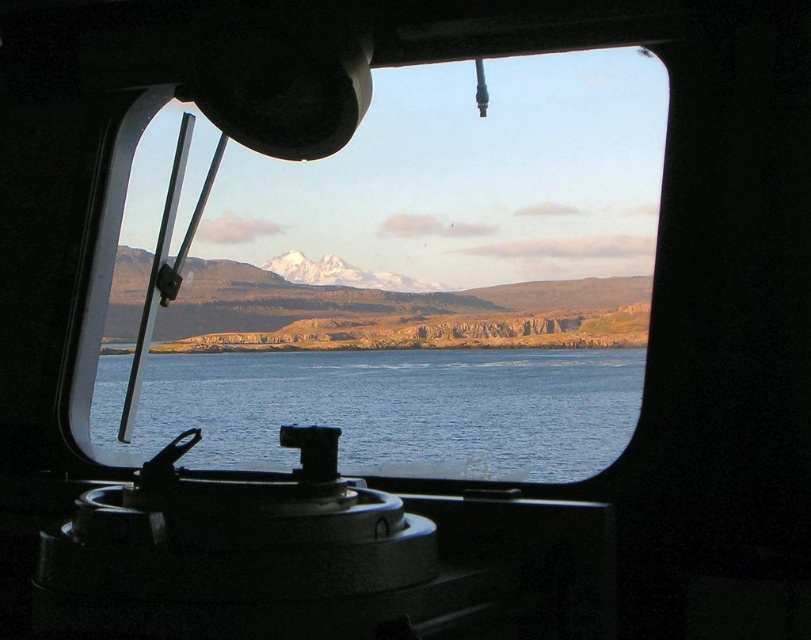
Question: Does blue water at center appear under snowy rock mountain at center?

Choices:
 (A) yes
 (B) no

Answer: (A)

Question: Does transparent glass window at center have a larger size compared to blue water at center?

Choices:
 (A) no
 (B) yes

Answer: (B)

Question: Considering the real-world distances, which object is farthest from the transparent glass window at center?

Choices:
 (A) blue water at center
 (B) snowy rock mountain at center

Answer: (A)

Question: Which point is closer to the camera taking this photo?

Choices:
 (A) (136, 448)
 (B) (556, 298)
 (C) (242, 435)

Answer: (A)

Question: Is blue water at center positioned at the back of snowy rock mountain at center?

Choices:
 (A) no
 (B) yes

Answer: (B)

Question: Which object is farther from the camera taking this photo?

Choices:
 (A) blue water at center
 (B) snowy rock mountain at center

Answer: (A)